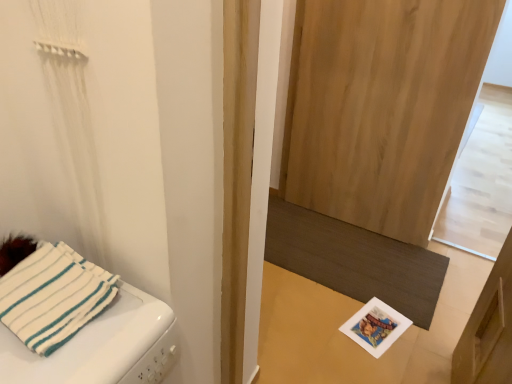
Question: Considering their positions, is white fabric towel at left located in front of or behind natural wood screen door at center?

Choices:
 (A) front
 (B) behind

Answer: (A)

Question: From the image's perspective, is white fabric towel at left located above or below natural wood screen door at center?

Choices:
 (A) above
 (B) below

Answer: (B)

Question: Estimate the real-world distances between objects in this image. Which object is farther from the dark brown textured mat at lower center?

Choices:
 (A) natural wood screen door at center
 (B) white fabric towel at left

Answer: (B)

Question: Estimate the real-world distances between objects in this image. Which object is closer to the dark brown textured mat at lower center?

Choices:
 (A) natural wood screen door at center
 (B) white fabric towel at left

Answer: (A)